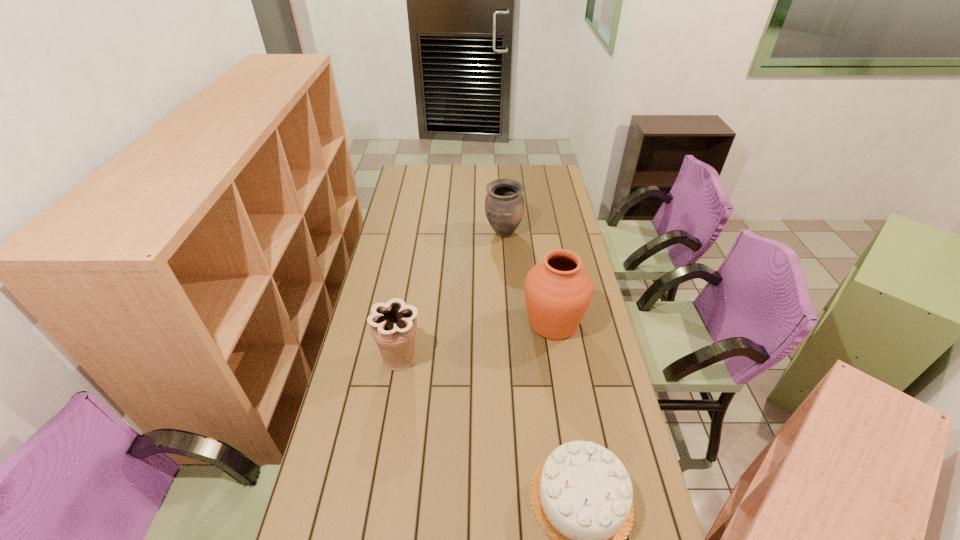
Locate which urn is the closest to the tallest urn. Please provide its 2D coordinates. Your answer should be formatted as a tuple, i.e. [(x, y)], where the tuple contains the x and y coordinates of a point satisfying the conditions above.

[(393, 324)]

Where is `free region that satisfies the following two spatial constraints: 1. on the back side of the farthest object; 2. on the left side of the second shortest object`? Image resolution: width=960 pixels, height=540 pixels. free region that satisfies the following two spatial constraints: 1. on the back side of the farthest object; 2. on the left side of the second shortest object is located at coordinates (421, 233).